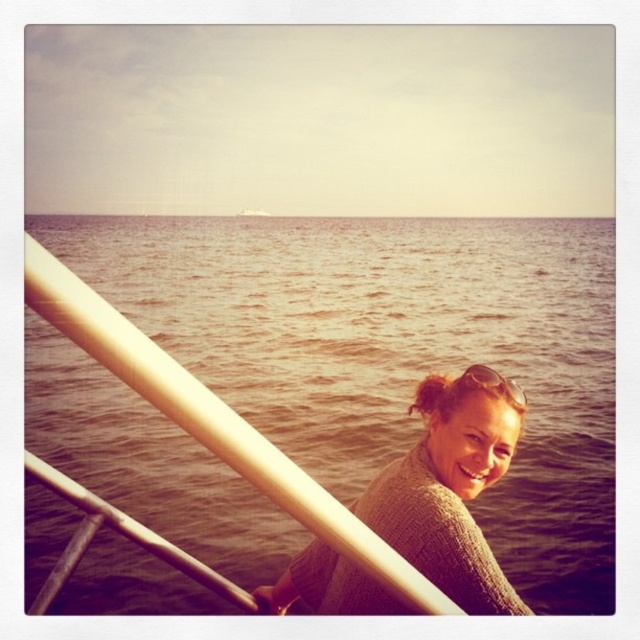
Question: Among these objects, which one is nearest to the camera?

Choices:
 (A) knitted sweater at center
 (B) sunglasses at center

Answer: (A)

Question: Does knitted sweater at center appear under sunglasses at center?

Choices:
 (A) yes
 (B) no

Answer: (A)

Question: Does knitted sweater at center appear over sunglasses at center?

Choices:
 (A) yes
 (B) no

Answer: (B)

Question: Which object appears farthest from the camera in this image?

Choices:
 (A) brown water at center
 (B) knitted sweater at center
 (C) sunglasses at center

Answer: (A)

Question: Which is farther from the brown water at center?

Choices:
 (A) sunglasses at center
 (B) knitted sweater at center

Answer: (A)

Question: Observing the image, what is the correct spatial positioning of brown water at center in reference to knitted sweater at center?

Choices:
 (A) right
 (B) left

Answer: (B)